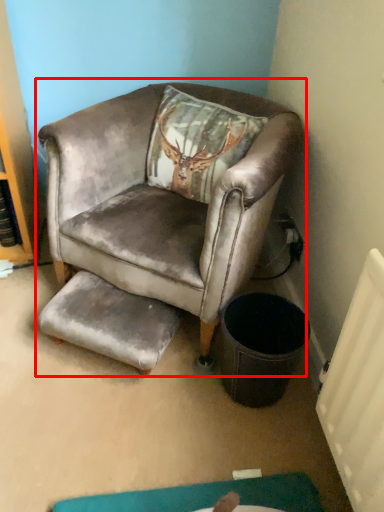
Question: Considering the relative positions of chair (annotated by the red box) and footrest in the image provided, where is chair (annotated by the red box) located with respect to the staircase?

Choices:
 (A) right
 (B) left

Answer: (A)